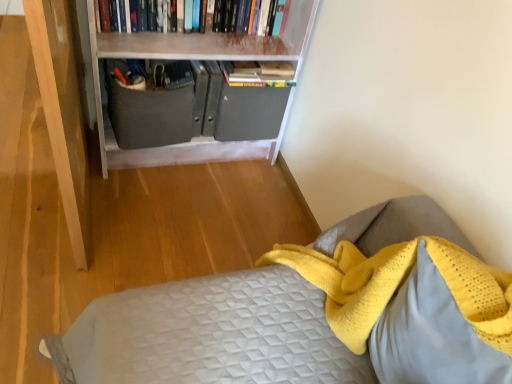
The width and height of the screenshot is (512, 384). Identify the location of free spot in front of white matte bookcase at upper center. (159, 221).